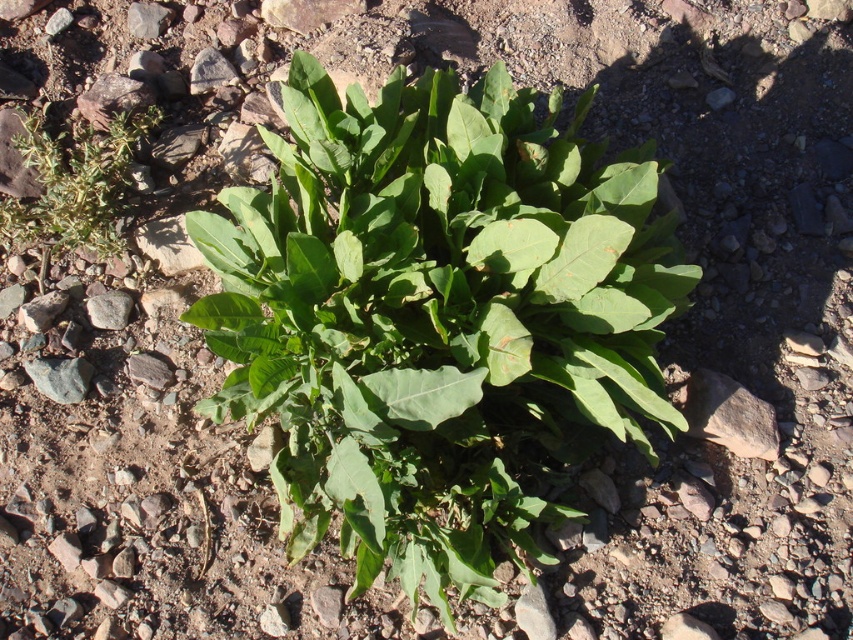
You are a botanist examining two green leafy plants in the image. Which one is positioned closer to you, the green leafy plant at center or the green leafy plant at left?

The green leafy plant at center is closer to the viewer than the green leafy plant at left.

You are a botanist studying two green leafy plants in a rocky area. You notice the green leafy plant at center and the green leafy plant at left. Which plant has a wider spread of leaves?

The green leafy plant at center has a wider spread of leaves than the green leafy plant at left, as its width surpasses the other.